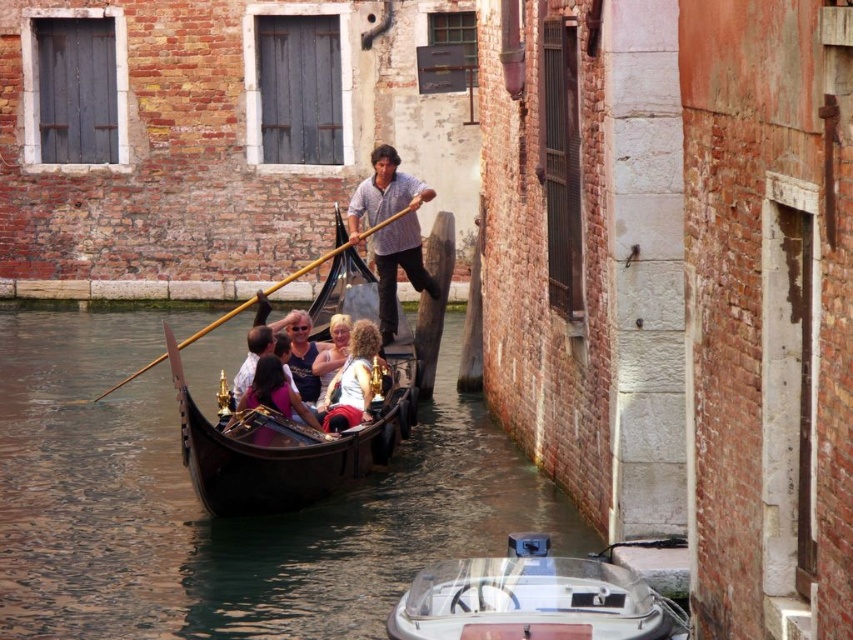
Can you confirm if black water at center is smaller than white glossy motorboat at center?

Incorrect, black water at center is not smaller in size than white glossy motorboat at center.

Does black water at center have a lesser height compared to white glossy motorboat at center?

Incorrect, black water at center's height does not fall short of white glossy motorboat at center's.

The height and width of the screenshot is (640, 853). I want to click on black water at center, so click(218, 518).

Which is behind, point (325, 419) or point (286, 387)?

Positioned behind is point (325, 419).

How distant is white cotton shirt at center from matte black shirt at center?

They are 5.74 feet apart.

This screenshot has height=640, width=853. Describe the element at coordinates (352, 380) in the screenshot. I see `white cotton shirt at center` at that location.

Find the location of `white cotton shirt at center`. white cotton shirt at center is located at coordinates (352, 380).

Which is in front, point (62, 371) or point (323, 396)?

Point (323, 396)

The height and width of the screenshot is (640, 853). What are the coordinates of `black water at center` in the screenshot? It's located at (218, 518).

Which is behind, point (24, 554) or point (344, 352)?

Positioned behind is point (344, 352).

Identify the location of black water at center. (218, 518).